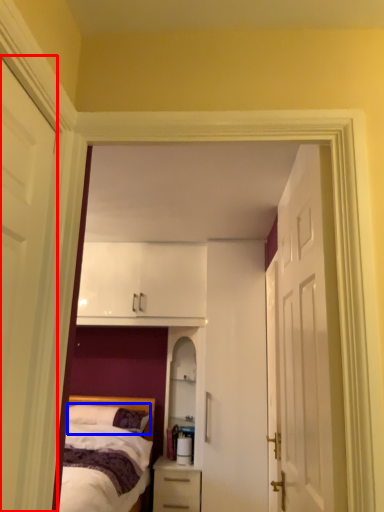
Question: Which point is closer to the camera, door (highlighted by a red box) or pillow (highlighted by a blue box)?

Choices:
 (A) door
 (B) pillow

Answer: (A)